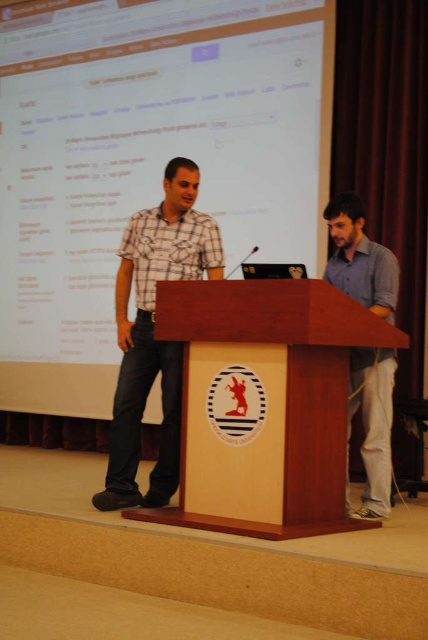
You are an event organizer setting up a presentation. You need to place a decorative banner between the matte white screen at upper center and the matte black screen at center. Which screen should the banner be closer to based on their positions?

The matte white screen at upper center is closer to the viewer than the matte black screen at center, so the banner should be placed closer to the matte white screen at upper center to maintain visual balance.

You are a photographer positioned at the camera. You need to capture a photo of the matte white screen at upper center. The camera has a focal length of 50mm. To ensure the screen is in focus, what is the minimum distance in feet you should be from the screen?

The matte white screen at upper center is 14.85 feet away from the camera. Since the camera is already positioned at that distance, you should remain at 14.85 feet to keep the screen in focus.

You are organizing a small event and need to place a 2.5 feet wide decorative banner behind the wooden podium at center and the gray cotton shirt at right. Considering their sizes, which object should the banner be placed closer to?

The wooden podium at center is larger in size than the gray cotton shirt at right, so the banner should be placed closer to the wooden podium at center to ensure proper visibility and alignment.